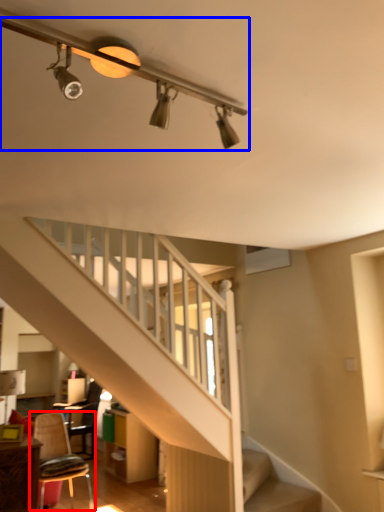
Question: Which object is closer to the camera taking this photo, chair (highlighted by a red box) or light fixture (highlighted by a blue box)?

Choices:
 (A) chair
 (B) light fixture

Answer: (B)